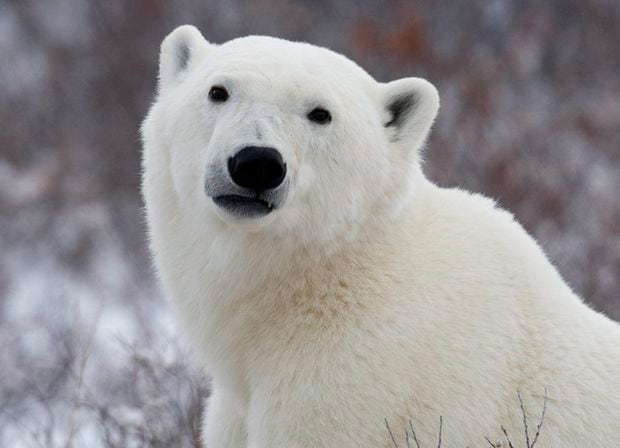
Identify the location of white fur. (388, 256).